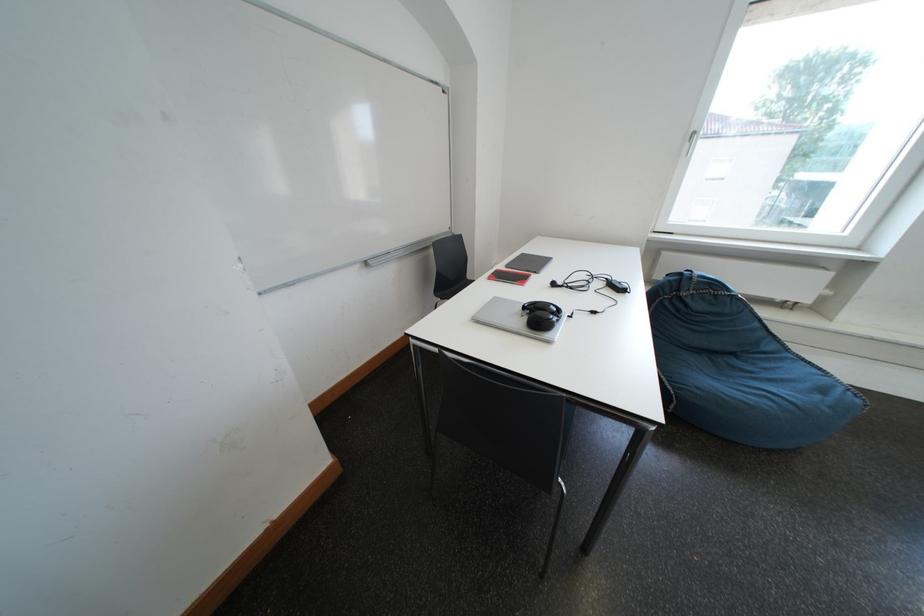
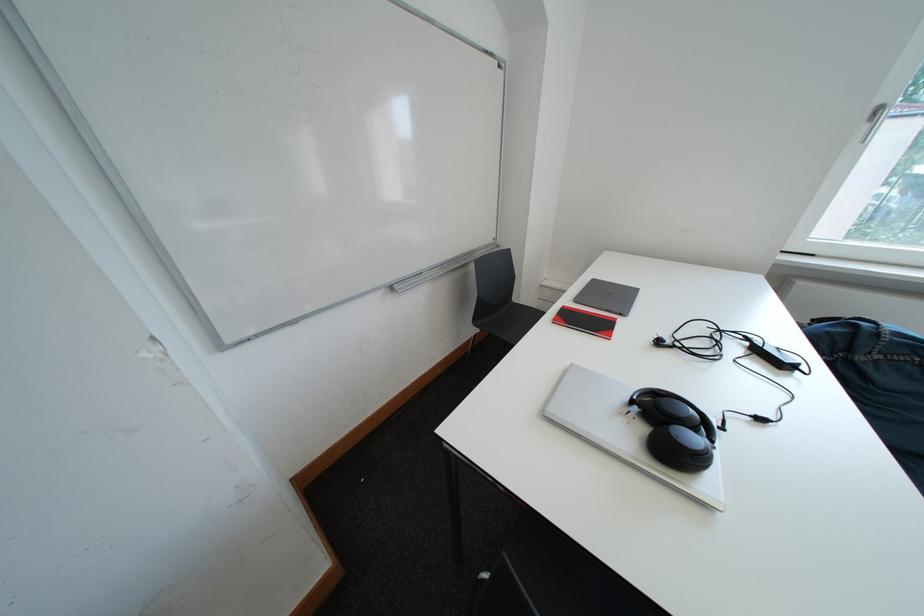
The point at (378, 267) is marked in the first image. Where is the corresponding point in the second image?

(403, 292)